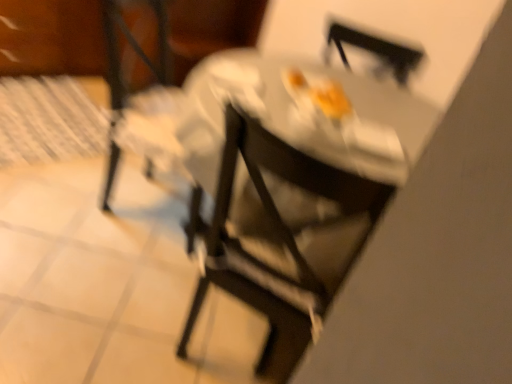
Question: Considering the relative sizes of metallic silver chair at center, the 2th chair viewed from the left, and wooden table at upper left in the image provided, is metallic silver chair at center, the 2th chair viewed from the left, smaller than wooden table at upper left?

Choices:
 (A) no
 (B) yes

Answer: (B)

Question: Considering the relative positions of metallic silver chair at center, the 2th chair viewed from the left, and wooden table at upper left in the image provided, is metallic silver chair at center, the 2th chair viewed from the left, behind wooden table at upper left?

Choices:
 (A) yes
 (B) no

Answer: (B)

Question: Does metallic silver chair at center, the 2th chair viewed from the left, appear on the right side of wooden table at upper left?

Choices:
 (A) no
 (B) yes

Answer: (B)

Question: From a real-world perspective, is metallic silver chair at center, the 2th chair viewed from the left, below wooden table at upper left?

Choices:
 (A) yes
 (B) no

Answer: (B)

Question: Does metallic silver chair at center, the 2th chair viewed from the left, have a greater width compared to wooden table at upper left?

Choices:
 (A) yes
 (B) no

Answer: (B)

Question: Is wooden table at upper left spatially inside matte black chair at center, acting as the 2th chair starting from the right, or outside of it?

Choices:
 (A) outside
 (B) inside

Answer: (A)

Question: In terms of height, does wooden table at upper left look taller or shorter compared to matte black chair at center, acting as the 2th chair starting from the right?

Choices:
 (A) short
 (B) tall

Answer: (A)

Question: Looking at their shapes, would you say wooden table at upper left is wider or thinner than matte black chair at center, which is the first chair in left-to-right order?

Choices:
 (A) wide
 (B) thin

Answer: (A)

Question: From a real-world perspective, is wooden table at upper left above or below matte black chair at center, which is the first chair in left-to-right order?

Choices:
 (A) above
 (B) below

Answer: (B)

Question: Choose the correct answer: Is metallic silver chair at center, the 1th chair viewed from the right, inside wooden table at upper left or outside it?

Choices:
 (A) inside
 (B) outside

Answer: (B)

Question: Is metallic silver chair at center, the 1th chair viewed from the right, in front of or behind wooden table at upper left in the image?

Choices:
 (A) behind
 (B) front

Answer: (B)

Question: Considering the relative positions of metallic silver chair at center, the 2th chair viewed from the left, and wooden table at upper left in the image provided, is metallic silver chair at center, the 2th chair viewed from the left, to the left or to the right of wooden table at upper left?

Choices:
 (A) right
 (B) left

Answer: (A)

Question: In terms of width, does metallic silver chair at center, the 1th chair viewed from the right, look wider or thinner when compared to wooden table at upper left?

Choices:
 (A) thin
 (B) wide

Answer: (A)

Question: Considering the positions of matte black chair at center, which is the first chair in left-to-right order, and metallic silver chair at center, the 1th chair viewed from the right, in the image, is matte black chair at center, which is the first chair in left-to-right order, taller or shorter than metallic silver chair at center, the 1th chair viewed from the right,?

Choices:
 (A) short
 (B) tall

Answer: (B)

Question: Looking at their shapes, would you say matte black chair at center, which is the first chair in left-to-right order, is wider or thinner than metallic silver chair at center, the 2th chair viewed from the left?

Choices:
 (A) thin
 (B) wide

Answer: (B)